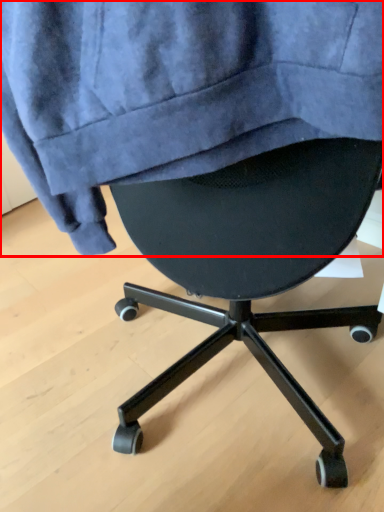
Question: Considering the relative positions of sweatshirt (annotated by the red box) and chair in the image provided, where is sweatshirt (annotated by the red box) located with respect to the staircase?

Choices:
 (A) left
 (B) right

Answer: (B)